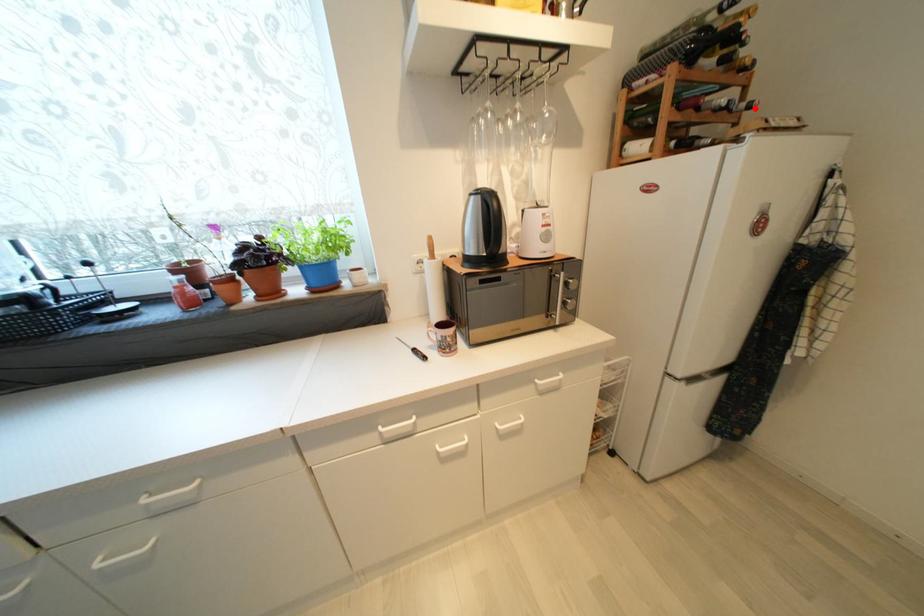
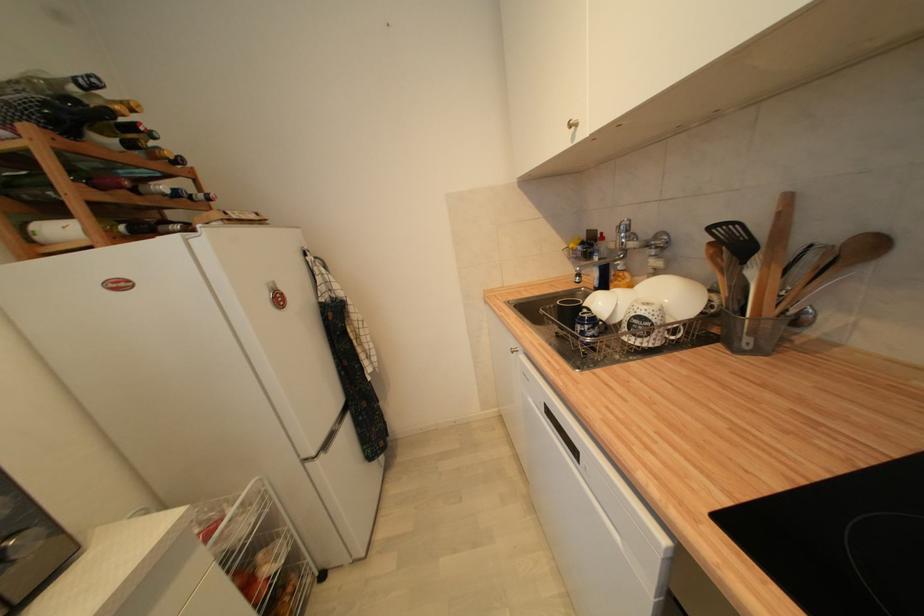
Where in the second image is the point corresponding to the highlighted location from the first image?

(213, 200)